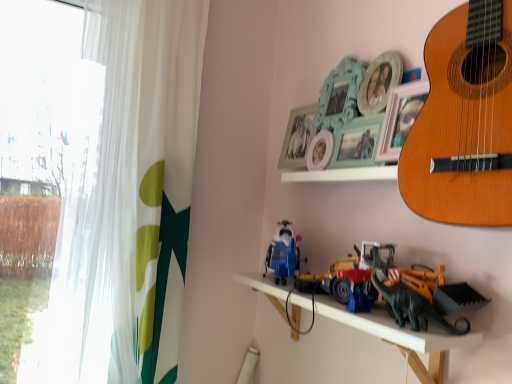
Question: Is white sheer curtain at left further to camera compared to light brown wooden guitar at upper right?

Choices:
 (A) no
 (B) yes

Answer: (B)

Question: Does white sheer curtain at left have a greater height compared to light brown wooden guitar at upper right?

Choices:
 (A) yes
 (B) no

Answer: (A)

Question: Is white sheer curtain at left outside light brown wooden guitar at upper right?

Choices:
 (A) yes
 (B) no

Answer: (A)

Question: Considering the relative sizes of white sheer curtain at left and light brown wooden guitar at upper right in the image provided, is white sheer curtain at left smaller than light brown wooden guitar at upper right?

Choices:
 (A) no
 (B) yes

Answer: (A)

Question: From a real-world perspective, is white sheer curtain at left on top of light brown wooden guitar at upper right?

Choices:
 (A) no
 (B) yes

Answer: (A)

Question: Does point (41, 99) appear closer or farther from the camera than point (411, 160)?

Choices:
 (A) farther
 (B) closer

Answer: (A)

Question: Visually, is transparent fabric at left positioned to the left or to the right of light brown wooden guitar at upper right?

Choices:
 (A) right
 (B) left

Answer: (B)

Question: From the image's perspective, relative to light brown wooden guitar at upper right, is transparent fabric at left above or below?

Choices:
 (A) below
 (B) above

Answer: (A)

Question: Relative to light brown wooden guitar at upper right, is transparent fabric at left in front or behind?

Choices:
 (A) behind
 (B) front

Answer: (A)

Question: In the image, is metallic plastic toys at center on the left side or the right side of transparent fabric at left?

Choices:
 (A) right
 (B) left

Answer: (A)

Question: Would you say metallic plastic toys at center is inside or outside transparent fabric at left?

Choices:
 (A) inside
 (B) outside

Answer: (B)

Question: From the image's perspective, is metallic plastic toys at center located above or below transparent fabric at left?

Choices:
 (A) above
 (B) below

Answer: (B)

Question: Is metallic plastic toys at center wider or thinner than transparent fabric at left?

Choices:
 (A) thin
 (B) wide

Answer: (B)

Question: Is white sheer curtain at left taller or shorter than yellow plastic construction vehicle at lower right, which ranks as the 1th toy in right-to-left order?

Choices:
 (A) short
 (B) tall

Answer: (B)

Question: Which is correct: white sheer curtain at left is inside yellow plastic construction vehicle at lower right, which ranks as the 1th toy in right-to-left order, or outside of it?

Choices:
 (A) inside
 (B) outside

Answer: (B)